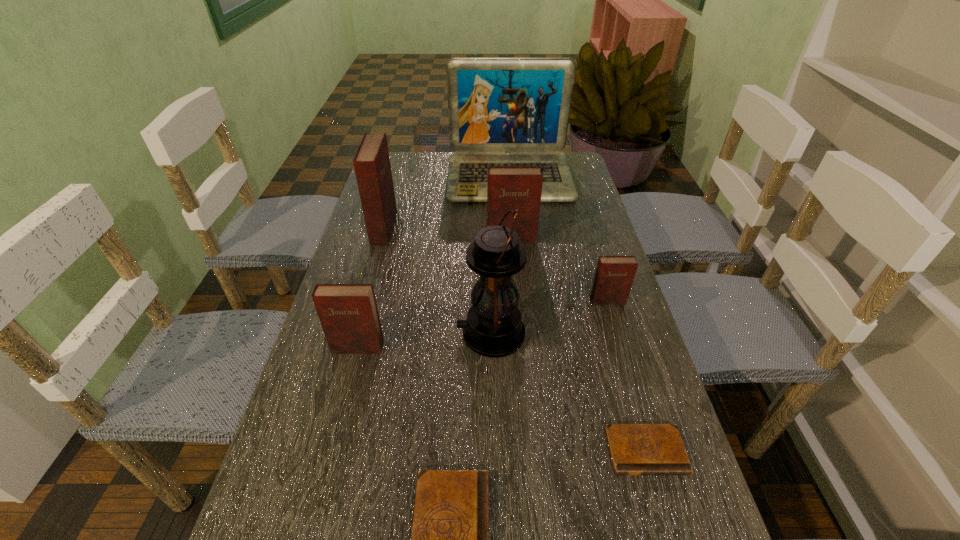
This screenshot has height=540, width=960. I want to click on vacant point located between the third nearest diary and the black lantern, so click(424, 341).

Locate an element on the screen. The image size is (960, 540). vacant area between the fourth farthest diary and the lantern is located at coordinates (424, 341).

Select which object is the second closest to the laptop computer. Please provide its 2D coordinates. Your answer should be formatted as a tuple, i.e. [(x, y)], where the tuple contains the x and y coordinates of a point satisfying the conditions above.

[(509, 187)]

Image resolution: width=960 pixels, height=540 pixels. Identify the location of object that is the second closest to the bigger brown diary. (494, 328).

Locate which diary is the third closest to the second biggest reddish-brown diary. Please provide its 2D coordinates. Your answer should be formatted as a tuple, i.e. [(x, y)], where the tuple contains the x and y coordinates of a point satisfying the conditions above.

[(348, 313)]

Choose which diary is the third nearest neighbor to the fourth tallest object. Please provide its 2D coordinates. Your answer should be formatted as a tuple, i.e. [(x, y)], where the tuple contains the x and y coordinates of a point satisfying the conditions above.

[(348, 313)]

You are a GUI agent. You are given a task and a screenshot of the screen. Output one action in this format:
    pyautogui.click(x=<x>, y=<y>)
    Task: Click on the second closest reddish-brown diary relative to the lantern
    
    Given the screenshot: What is the action you would take?
    pyautogui.click(x=614, y=275)

Locate an element on the screen. reddish-brown diary that stands as the second closest to the farthest object is located at coordinates (509, 187).